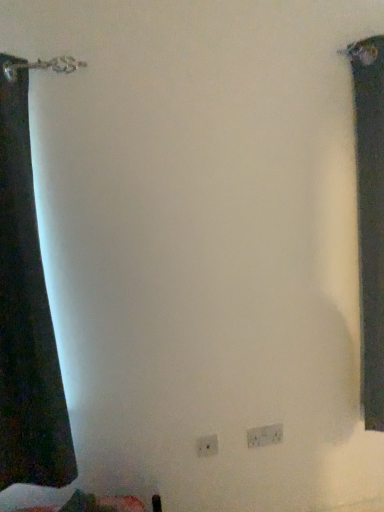
Question: Is white plastic electric outlet at lower center, which is counted as the first electric outlet, starting from the right, surrounded by white plastic electric outlet at lower center, the 1th electric outlet when ordered from left to right?

Choices:
 (A) yes
 (B) no

Answer: (B)

Question: Does white plastic electric outlet at lower center, which is the second electric outlet in back-to-front order, have a greater height compared to white plastic electric outlet at lower center, which is counted as the first electric outlet, starting from the right?

Choices:
 (A) no
 (B) yes

Answer: (A)

Question: Is white plastic electric outlet at lower center, which is the second electric outlet in back-to-front order, closer to the viewer compared to white plastic electric outlet at lower center, which ranks as the 1th electric outlet in back-to-front order?

Choices:
 (A) yes
 (B) no

Answer: (A)

Question: Is white plastic electric outlet at lower center, which is the second electric outlet in back-to-front order, further to camera compared to white plastic electric outlet at lower center, placed as the 2th electric outlet when sorted from left to right?

Choices:
 (A) no
 (B) yes

Answer: (A)

Question: Is white plastic electric outlet at lower center, the second electric outlet in the right-to-left sequence, facing away from white plastic electric outlet at lower center, which ranks as the 1th electric outlet in back-to-front order?

Choices:
 (A) yes
 (B) no

Answer: (B)

Question: Does point (208, 451) appear closer or farther from the camera than point (269, 440)?

Choices:
 (A) farther
 (B) closer

Answer: (B)

Question: Is white plastic electric outlet at lower center, which is the second electric outlet in back-to-front order, inside or outside of white plastic electric outlet at lower center, which is counted as the 2th electric outlet, starting from the front?

Choices:
 (A) outside
 (B) inside

Answer: (A)

Question: From the image's perspective, is white plastic electric outlet at lower center, the first electric outlet from the front, positioned above or below white plastic electric outlet at lower center, which is counted as the 2th electric outlet, starting from the front?

Choices:
 (A) below
 (B) above

Answer: (A)

Question: In terms of size, does white plastic electric outlet at lower center, the 1th electric outlet when ordered from left to right, appear bigger or smaller than white plastic electric outlet at lower center, which is counted as the 2th electric outlet, starting from the front?

Choices:
 (A) big
 (B) small

Answer: (B)

Question: Is white plastic electric outlet at lower center, which is counted as the first electric outlet, starting from the right, situated inside dark fabric curtain at right or outside?

Choices:
 (A) outside
 (B) inside

Answer: (A)

Question: Considering the positions of white plastic electric outlet at lower center, which ranks as the 1th electric outlet in back-to-front order, and dark fabric curtain at right in the image, is white plastic electric outlet at lower center, which ranks as the 1th electric outlet in back-to-front order, taller or shorter than dark fabric curtain at right?

Choices:
 (A) short
 (B) tall

Answer: (A)

Question: Is white plastic electric outlet at lower center, which ranks as the 1th electric outlet in back-to-front order, wider or thinner than dark fabric curtain at right?

Choices:
 (A) thin
 (B) wide

Answer: (A)

Question: Is white plastic electric outlet at lower center, which is counted as the 2th electric outlet, starting from the front, bigger or smaller than dark fabric curtain at right?

Choices:
 (A) small
 (B) big

Answer: (A)

Question: Is white plastic electric outlet at lower center, placed as the 2th electric outlet when sorted from left to right, in front of or behind white plastic electric outlet at lower center, the first electric outlet from the front, in the image?

Choices:
 (A) front
 (B) behind

Answer: (B)

Question: From the image's perspective, relative to white plastic electric outlet at lower center, the first electric outlet from the front, is white plastic electric outlet at lower center, which ranks as the 1th electric outlet in back-to-front order, above or below?

Choices:
 (A) below
 (B) above

Answer: (B)